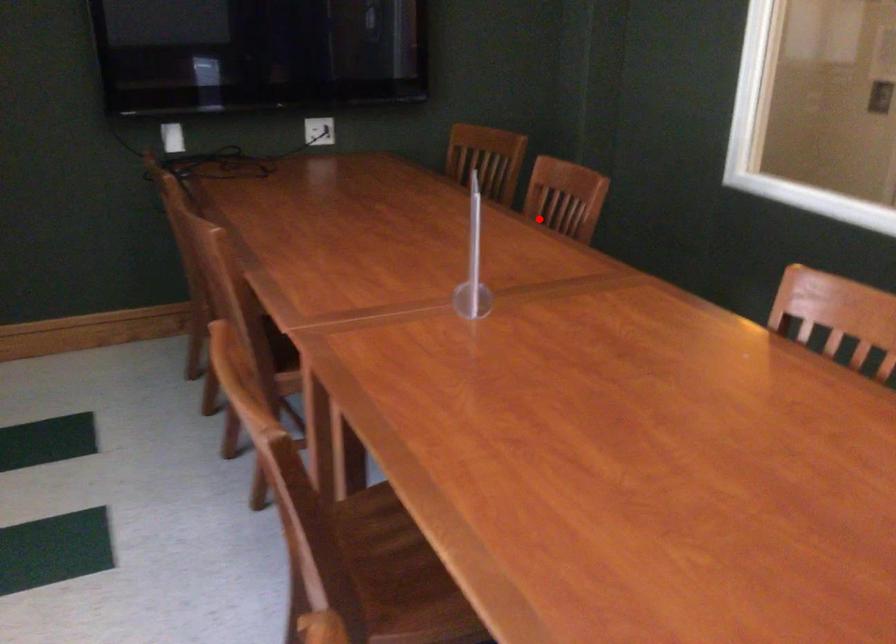
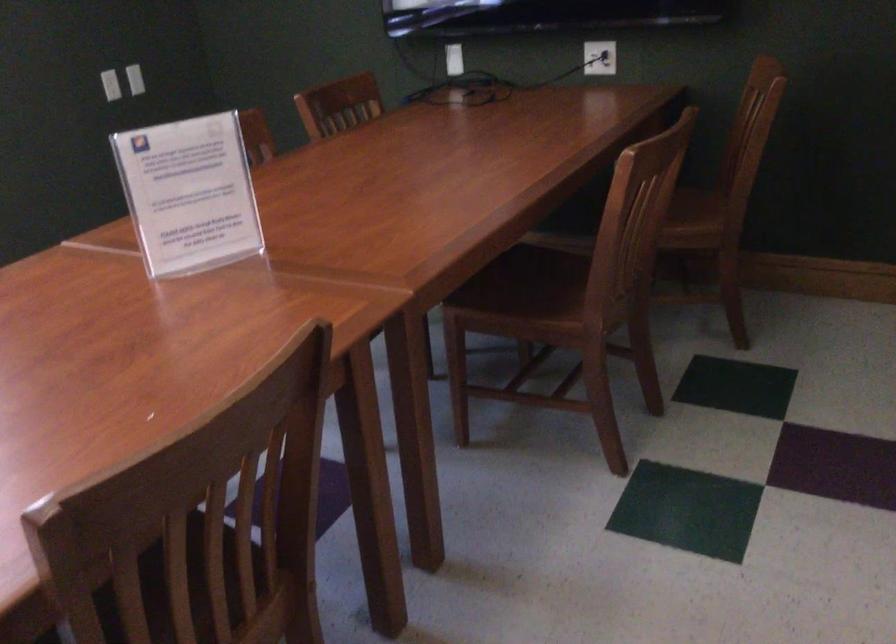
The point at the highlighted location is marked in the first image. Where is the corresponding point in the second image?

(668, 205)